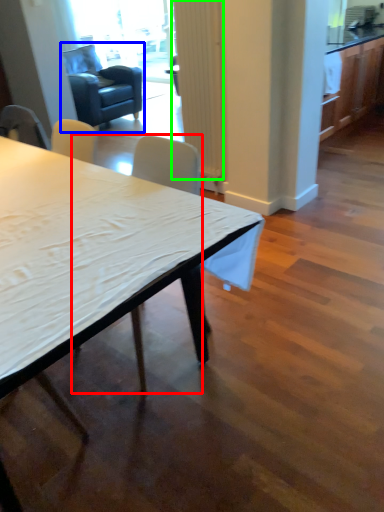
Question: Which object is positioned closest to chair (highlighted by a red box)? Select from swivel chair (highlighted by a blue box) and curtain (highlighted by a green box).

Choices:
 (A) swivel chair
 (B) curtain

Answer: (B)